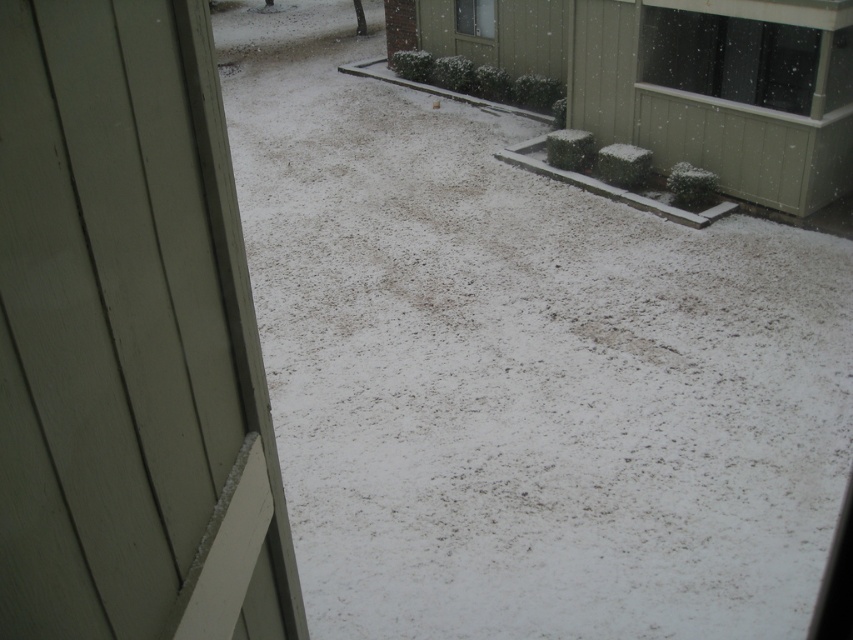
You are a window cleaner with a ladder that can extend up to 5 meters. You need to clean both the transparent glass window at upper right and the clear glass window at upper center. Can your ladder reach both windows from the same spot without moving it?

The distance between the transparent glass window at upper right and clear glass window at upper center is 4.82 meters. Since your ladder can extend up to 5 meters, it can reach both windows from the same spot without moving it.

You are an interior designer assessing the space. You need to hang a decorative wreath that requires 1.2 meters of vertical space. Given the matte green screen door at left and the transparent glass window at upper right, which object provides enough vertical space for the wreath?

The matte green screen door at left has a greater height compared to the transparent glass window at upper right, so it can accommodate the 1.2 meters required for the wreath.

You are trying to determine which object is wider between the matte green screen door at left and the transparent glass window at upper right. Based on the scene, can you figure out which one is wider?

The transparent glass window at upper right is wider than the matte green screen door at left.